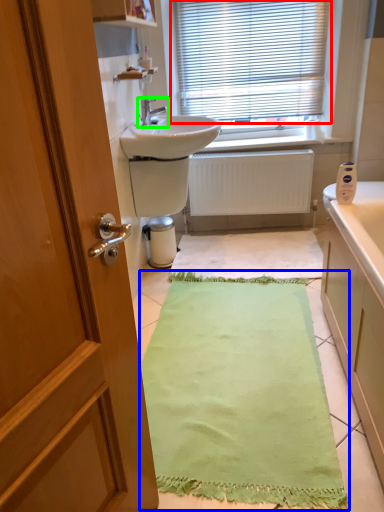
Question: Which is nearer to the window blind (highlighted by a red box)? bath mat (highlighted by a blue box) or tap (highlighted by a green box).

Choices:
 (A) bath mat
 (B) tap

Answer: (B)